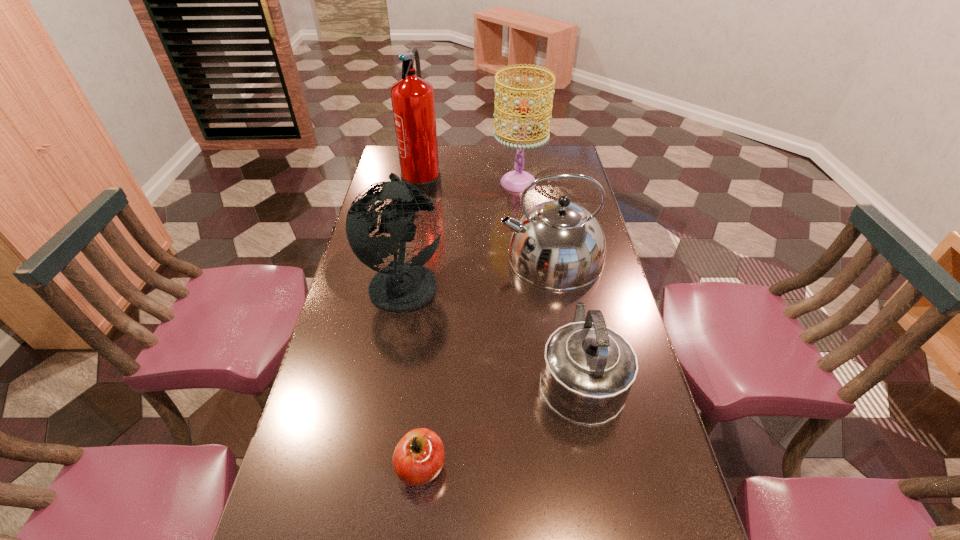
Locate an element on the screen. The height and width of the screenshot is (540, 960). fire extinguisher that is at the left edge is located at coordinates (412, 97).

Where is `globe that is at the left edge`? The image size is (960, 540). globe that is at the left edge is located at coordinates (401, 287).

Identify the location of lampshade that is at the right edge. This screenshot has width=960, height=540. (516, 181).

Identify the location of object at the far left corner. The height and width of the screenshot is (540, 960). (412, 97).

Locate an element on the screen. object situated at the far right corner is located at coordinates (516, 181).

Image resolution: width=960 pixels, height=540 pixels. In the image, there is a desktop. Identify the location of free region at the far edge. (477, 157).

At what (x,y) coordinates should I click in order to perform the action: click on free spot at the left edge of the desktop. Please return your answer as a coordinate pair (x, y). This screenshot has width=960, height=540. Looking at the image, I should click on (344, 302).

This screenshot has width=960, height=540. In the image, there is a desktop. What are the coordinates of `blank space at the right edge` in the screenshot? It's located at (549, 195).

You are a GUI agent. You are given a task and a screenshot of the screen. Output one action in this format:
    pyautogui.click(x=<x>, y=<y>)
    Task: Click on the vacant space at the far left corner of the desktop
    
    Given the screenshot: What is the action you would take?
    pyautogui.click(x=398, y=169)

This screenshot has width=960, height=540. Find the location of `empty space between the tallest object and the second tallest object`. empty space between the tallest object and the second tallest object is located at coordinates (470, 181).